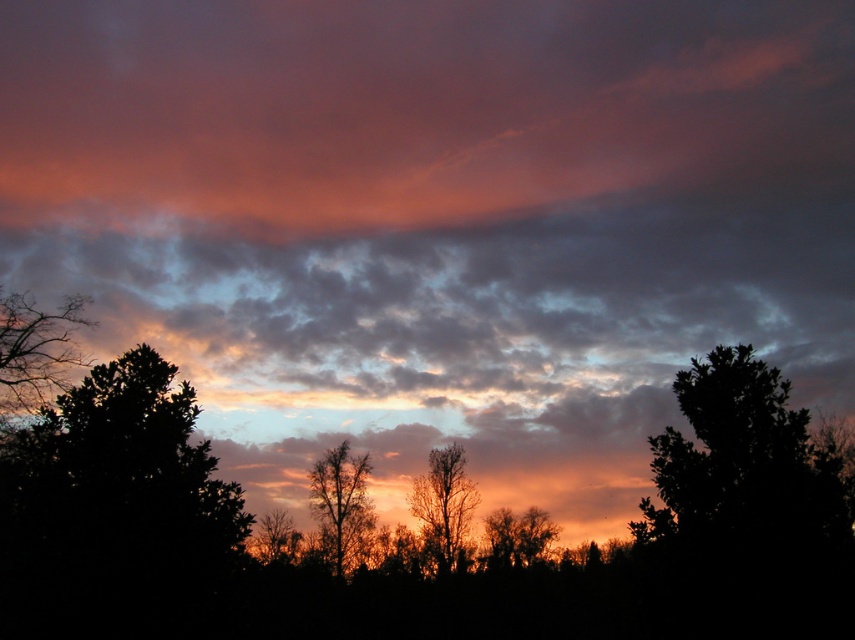
You are an artist painting the sunset scene. You need to place the bare branches at left and the silhouette tree at center in your painting. According to the scene, which one should you draw first to ensure proper positioning?

The bare branches at left should be drawn first because it is positioned on the left side of the silhouette tree at center, so placing it first ensures it is correctly placed to the left of the central tree.